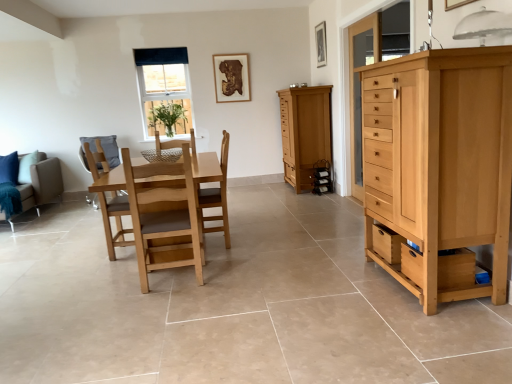
Question: From a real-world perspective, is wooden picture frame at upper center, the first picture frame from the right, located higher than natural wood chest of drawers at right?

Choices:
 (A) no
 (B) yes

Answer: (B)

Question: Are wooden picture frame at upper center, the first picture frame from the right, and natural wood chest of drawers at right beside each other?

Choices:
 (A) yes
 (B) no

Answer: (B)

Question: From the image's perspective, does wooden picture frame at upper center, the first picture frame from the right, appear higher than natural wood chest of drawers at right?

Choices:
 (A) yes
 (B) no

Answer: (A)

Question: Is wooden picture frame at upper center, the first picture frame from the right, looking in the opposite direction of natural wood chest of drawers at right?

Choices:
 (A) no
 (B) yes

Answer: (A)

Question: Can you confirm if wooden picture frame at upper center, placed as the second picture frame when sorted from left to right, is smaller than natural wood chest of drawers at right?

Choices:
 (A) no
 (B) yes

Answer: (B)

Question: Is wooden picture frame at upper center, the first picture frame from the right, far from natural wood chest of drawers at right?

Choices:
 (A) yes
 (B) no

Answer: (A)

Question: From a real-world perspective, is light brown wooden chair at center, which appears as the 2th chair when viewed from the right, beneath matte wood cabinet at center?

Choices:
 (A) yes
 (B) no

Answer: (A)

Question: Is light brown wooden chair at center, which appears as the 2th chair when viewed from the right, with matte wood cabinet at center?

Choices:
 (A) yes
 (B) no

Answer: (B)

Question: Could you tell me if light brown wooden chair at center, which appears as the 2th chair when viewed from the right, is facing matte wood cabinet at center?

Choices:
 (A) yes
 (B) no

Answer: (B)

Question: Is light brown wooden chair at center, which appears as the 2th chair when viewed from the right, positioned far away from matte wood cabinet at center?

Choices:
 (A) no
 (B) yes

Answer: (B)

Question: Considering the relative sizes of light brown wooden chair at center, the first chair positioned from the left, and matte wood cabinet at center in the image provided, is light brown wooden chair at center, the first chair positioned from the left, shorter than matte wood cabinet at center?

Choices:
 (A) yes
 (B) no

Answer: (A)

Question: Does light brown wooden chair at center, the first chair positioned from the left, come behind matte wood cabinet at center?

Choices:
 (A) yes
 (B) no

Answer: (B)

Question: From the image's perspective, is wooden picture frame at upper center, placed as the second picture frame when sorted from left to right, on top of light brown wooden chair at center, which appears as the 2th chair when viewed from the right?

Choices:
 (A) yes
 (B) no

Answer: (A)